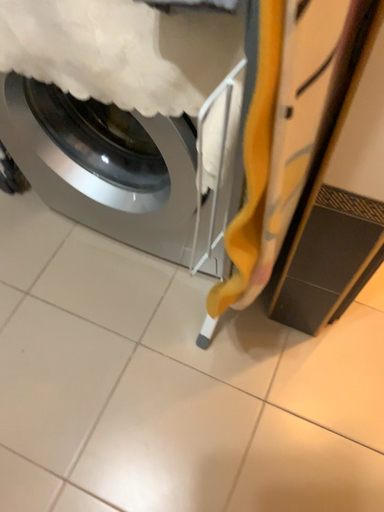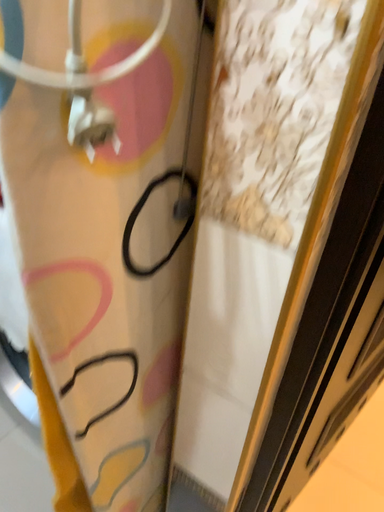
Question: Which way did the camera rotate in the video?

Choices:
 (A) rotated downward
 (B) rotated upward

Answer: (B)